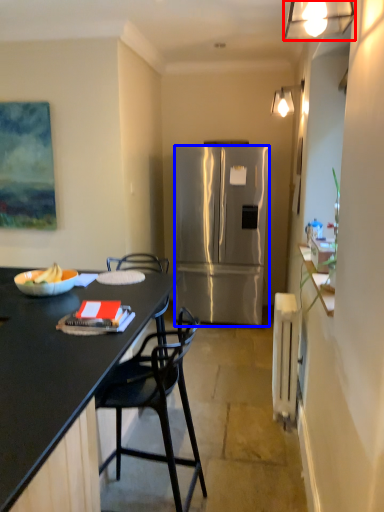
Question: Which of the following is the farthest to the observer, lamp (highlighted by a red box) or refrigerator (highlighted by a blue box)?

Choices:
 (A) lamp
 (B) refrigerator

Answer: (B)